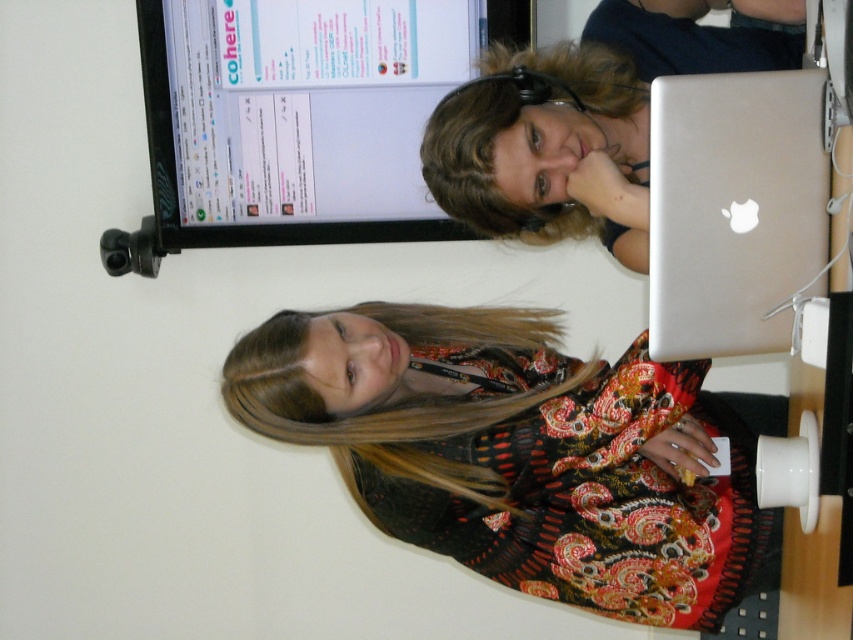
You are organizing a small event and need to place a decorative item between the printed fabric dress at center and the silver metallic laptop at right on the desk. Where should you place it to ensure it is between them?

Place the decorative item between the printed fabric dress at center and the silver metallic laptop at right, aligning it to the right of the printed fabric dress at center and to the left of the silver metallic laptop at right since the printed fabric dress at center is on the left side of the silver metallic laptop at right.

You are a delivery person who needs to place a small package on the desk between the printed fabric dress at center and the matte black monitor at upper center. Is there enough space between them to place the package?

The printed fabric dress at center is located below the matte black monitor at upper center, so there is vertical space between them. The package can be placed between them as long as it fits within the available vertical space.

Based on the photo, you are a fashion designer who wants to place a new accessory exactly at the center of the desk. The desk has a printed fabric dress at center. Where should you place the accessory?

The printed fabric dress at center is located at point (517, 451), so you should place the accessory at that coordinate to center it on the desk.